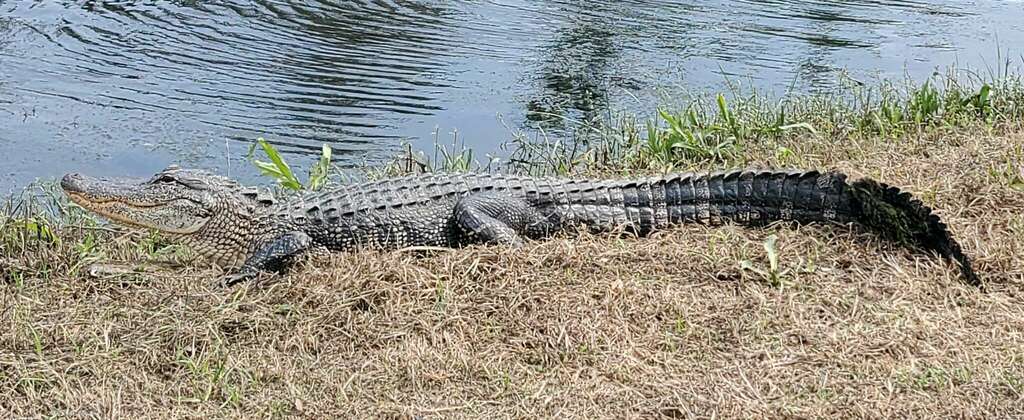
Image resolution: width=1024 pixels, height=420 pixels. What are the coordinates of `left front leg` in the screenshot? It's located at (287, 252).